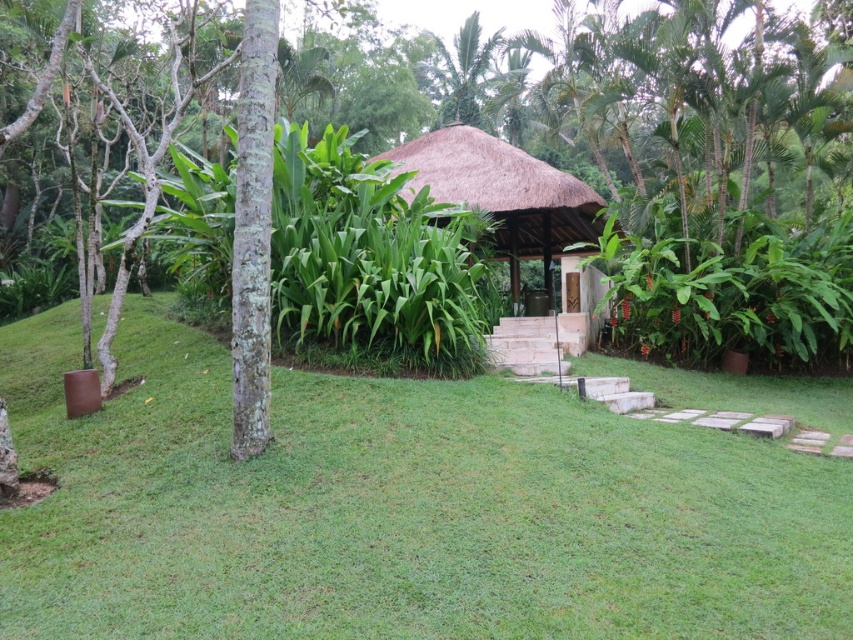
Which is above, green grass at center or brown textured tree at center?

brown textured tree at center

Which is more to the left, green grass at center or brown textured tree at center?

green grass at center

Between point (73, 568) and point (839, 280), which one is positioned in front?

Point (73, 568) is more forward.

The height and width of the screenshot is (640, 853). What are the coordinates of `green grass at center` in the screenshot? It's located at (397, 508).

Between green grass at center and thatched straw gazebo at center, which one is positioned higher?

thatched straw gazebo at center is above.

Is point (553, 477) positioned after point (549, 241)?

No, it is not.

Locate an element on the screen. This screenshot has width=853, height=640. green grass at center is located at coordinates (397, 508).

Measure the distance between brown textured tree at center and camera.

brown textured tree at center and camera are 4.55 meters apart from each other.

You are a GUI agent. You are given a task and a screenshot of the screen. Output one action in this format:
    pyautogui.click(x=<x>, y=<y>)
    Task: Click on the brown textured tree at center
    The image size is (853, 640).
    Given the screenshot: What is the action you would take?
    click(x=668, y=205)